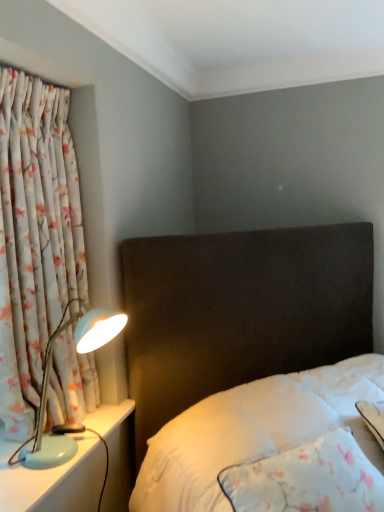
Question: Would you say light blue plastic lamp at left is part of floral fabric curtain at left's contents?

Choices:
 (A) yes
 (B) no

Answer: (A)

Question: Is floral fabric curtain at left oriented towards light blue plastic lamp at left?

Choices:
 (A) yes
 (B) no

Answer: (A)

Question: Are floral fabric curtain at left and light blue plastic lamp at left beside each other?

Choices:
 (A) no
 (B) yes

Answer: (A)

Question: Is floral fabric curtain at left at the left side of light blue plastic lamp at left?

Choices:
 (A) yes
 (B) no

Answer: (A)

Question: Considering the relative positions of floral fabric curtain at left and light blue plastic lamp at left in the image provided, is floral fabric curtain at left in front of light blue plastic lamp at left?

Choices:
 (A) yes
 (B) no

Answer: (A)

Question: Considering the relative sizes of floral fabric curtain at left and light blue plastic lamp at left in the image provided, is floral fabric curtain at left taller than light blue plastic lamp at left?

Choices:
 (A) yes
 (B) no

Answer: (A)

Question: Is light blue plastic lamp at left wider than floral fabric curtain at left?

Choices:
 (A) no
 (B) yes

Answer: (B)

Question: Considering the relative sizes of light blue plastic lamp at left and floral fabric curtain at left in the image provided, is light blue plastic lamp at left smaller than floral fabric curtain at left?

Choices:
 (A) no
 (B) yes

Answer: (B)

Question: Is light blue plastic lamp at left oriented away from floral fabric curtain at left?

Choices:
 (A) no
 (B) yes

Answer: (B)

Question: Considering the relative sizes of light blue plastic lamp at left and floral fabric curtain at left in the image provided, is light blue plastic lamp at left thinner than floral fabric curtain at left?

Choices:
 (A) yes
 (B) no

Answer: (B)

Question: Is light blue plastic lamp at left not inside floral fabric curtain at left?

Choices:
 (A) no
 (B) yes

Answer: (A)

Question: From the image's perspective, is light blue plastic lamp at left beneath floral fabric curtain at left?

Choices:
 (A) no
 (B) yes

Answer: (B)

Question: Looking at the image, does light blue plastic lamp at left seem bigger or smaller compared to floral fabric curtain at left?

Choices:
 (A) big
 (B) small

Answer: (B)